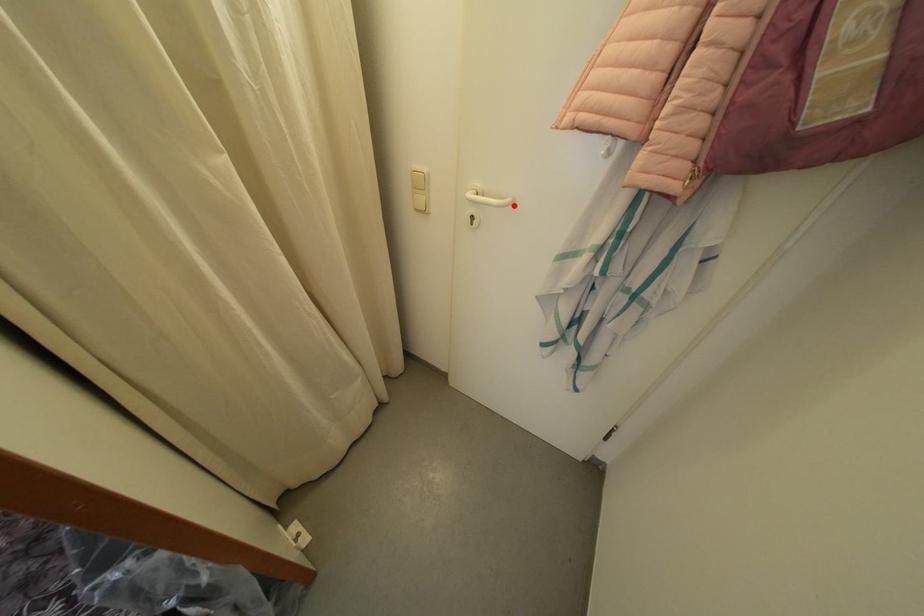
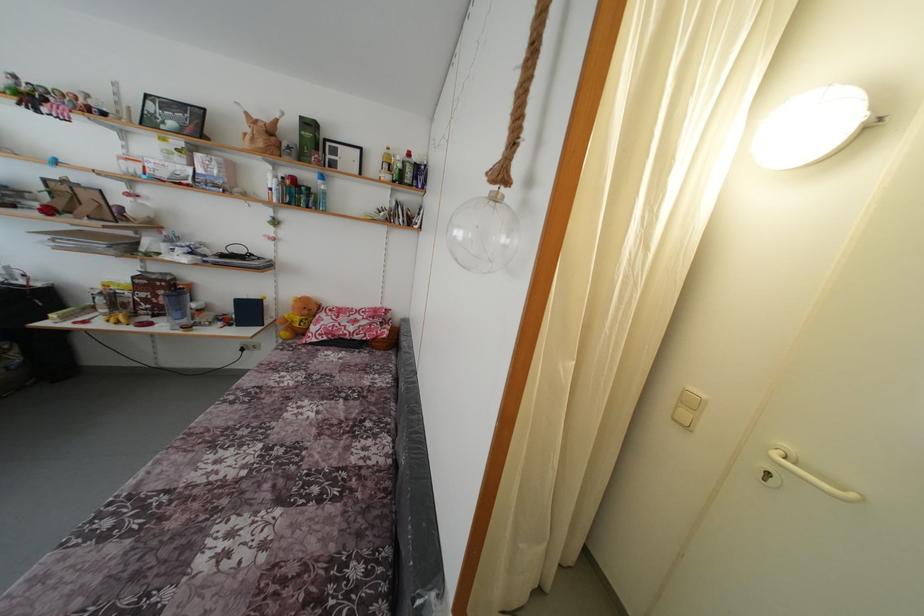
Locate, in the second image, the point that corresponds to the highlighted location in the first image.

(859, 501)